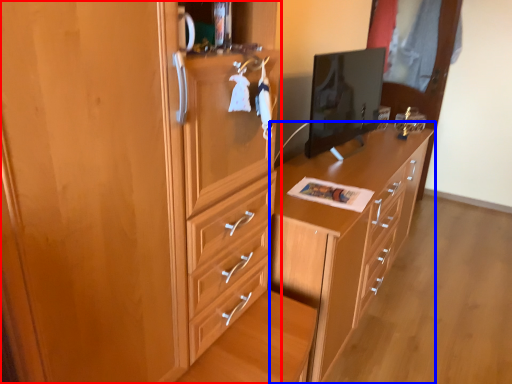
Question: Which object appears farthest to the camera in this image, cabinetry (highlighted by a red box) or chest of drawers (highlighted by a blue box)?

Choices:
 (A) cabinetry
 (B) chest of drawers

Answer: (B)